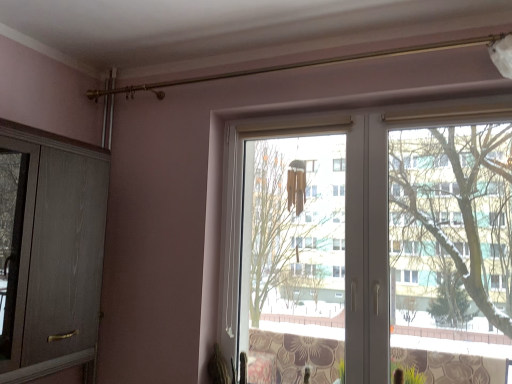
What do you see at coordinates (362, 222) in the screenshot?
I see `white plastic window at center` at bounding box center [362, 222].

You are a GUI agent. You are given a task and a screenshot of the screen. Output one action in this format:
    pyautogui.click(x=<x>, y=<y>)
    Task: Click on the white plastic window at center
    
    Given the screenshot: What is the action you would take?
    pyautogui.click(x=362, y=222)

In order to face matte wood screen door at left, should I rotate leftwards or rightwards?

A 29.072 degree turn to the left will do.

Describe the element at coordinates (49, 251) in the screenshot. I see `matte wood screen door at left` at that location.

The height and width of the screenshot is (384, 512). Identify the location of matte wood screen door at left. (49, 251).

Locate an element on the screen. white plastic window at center is located at coordinates (x=362, y=222).

Is white plastic window at center to the left of matte wood screen door at left from the viewer's perspective?

No.

Relative to matte wood screen door at left, is white plastic window at center in front or behind?

In the image, white plastic window at center appears behind matte wood screen door at left.

Is point (403, 304) farther from camera compared to point (49, 319)?

Yes, point (403, 304) is farther from viewer.

From the image's perspective, which object appears higher, white plastic window at center or matte wood screen door at left?

matte wood screen door at left is shown above in the image.

From a real-world perspective, which is physically below, white plastic window at center or matte wood screen door at left?

matte wood screen door at left is physically lower.

In the scene shown: Does white plastic window at center have a lesser width compared to matte wood screen door at left?

Correct, the width of white plastic window at center is less than that of matte wood screen door at left.

Which of these two, white plastic window at center or matte wood screen door at left, stands shorter?

With less height is matte wood screen door at left.

Which of these two, white plastic window at center or matte wood screen door at left, is smaller?

With smaller size is white plastic window at center.

Is matte wood screen door at left surrounded by white plastic window at center?

No, white plastic window at center does not contain matte wood screen door at left.

Is white plastic window at center next to matte wood screen door at left and touching it?

white plastic window at center and matte wood screen door at left are not in contact.

Is white plastic window at center looking in the opposite direction of matte wood screen door at left?

No, white plastic window at center is not facing the opposite direction of matte wood screen door at left.

How many degrees apart are the facing directions of white plastic window at center and matte wood screen door at left?

90.2 degrees separate the facing orientations of white plastic window at center and matte wood screen door at left.

Locate an element on the screen. Image resolution: width=512 pixels, height=384 pixels. screen door below the white plastic window at center (from a real-world perspective) is located at coordinates (49, 251).

Which object is positioned more to the left, matte wood screen door at left or white plastic window at center?

matte wood screen door at left is more to the left.

Relative to white plastic window at center, is matte wood screen door at left in front or behind?

Clearly, matte wood screen door at left is in front of white plastic window at center.

Is point (82, 209) positioned after point (511, 287)?

Yes.

From the image's perspective, between matte wood screen door at left and white plastic window at center, which one is located above?

matte wood screen door at left, from the image's perspective.

From a real-world perspective, is matte wood screen door at left on top of white plastic window at center?

Incorrect, from a real-world perspective, matte wood screen door at left is lower than white plastic window at center.

Is matte wood screen door at left thinner than white plastic window at center?

In fact, matte wood screen door at left might be wider than white plastic window at center.

Is matte wood screen door at left taller or shorter than white plastic window at center?

matte wood screen door at left is shorter than white plastic window at center.

Considering the sizes of objects matte wood screen door at left and white plastic window at center in the image provided, who is bigger, matte wood screen door at left or white plastic window at center?

matte wood screen door at left.

Would you say matte wood screen door at left is inside or outside white plastic window at center?

matte wood screen door at left exists outside the volume of white plastic window at center.

From the picture: Is matte wood screen door at left far from white plastic window at center?

No, matte wood screen door at left is in close proximity to white plastic window at center.

Is matte wood screen door at left looking in the opposite direction of white plastic window at center?

No, white plastic window at center is not at the back of matte wood screen door at left.

How different are the orientations of matte wood screen door at left and white plastic window at center in degrees?

matte wood screen door at left and white plastic window at center are facing 90.2 degrees away from each other.

The image size is (512, 384). Identify the location of bay window above the matte wood screen door at left (from a real-world perspective). (362, 222).

Image resolution: width=512 pixels, height=384 pixels. Identify the location of screen door that appears below the white plastic window at center (from a real-world perspective). (49, 251).

Find the location of a particular element. This screenshot has width=512, height=384. screen door above the white plastic window at center (from the image's perspective) is located at coordinates click(x=49, y=251).